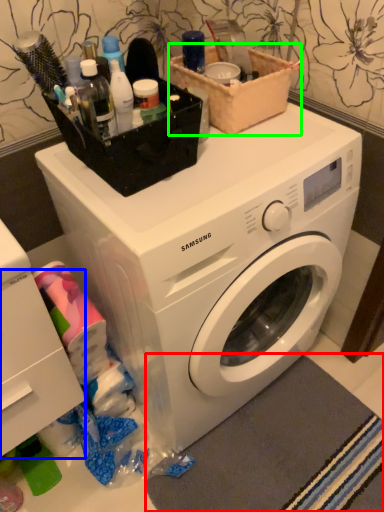
Question: Estimate the real-world distances between objects in this image. Which object is farther from bath mat (highlighted by a red box), drawer (highlighted by a blue box) or basket (highlighted by a green box)?

Choices:
 (A) drawer
 (B) basket

Answer: (B)